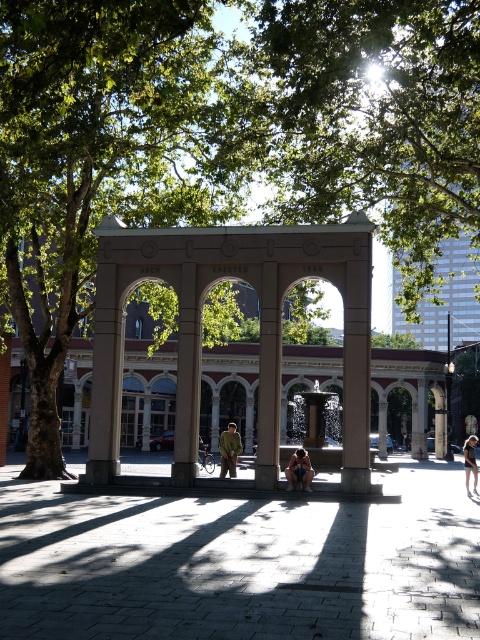
Question: Can you confirm if concrete bench at center is positioned above matte pink stone archway at center?

Choices:
 (A) yes
 (B) no

Answer: (B)

Question: Is concrete bench at center behind matte pink stone archway at center?

Choices:
 (A) no
 (B) yes

Answer: (A)

Question: Among these objects, which one is farthest from the camera?

Choices:
 (A) dark hair at center
 (B) matte pink stone archway at center
 (C) matte stone column at center

Answer: (A)

Question: Where is khaki fabric jacket at center located in relation to dark hair at center in the image?

Choices:
 (A) below
 (B) above

Answer: (B)

Question: Which point is farther to the camera?

Choices:
 (A) (224, 460)
 (B) (189, 346)
 (C) (273, 474)

Answer: (A)

Question: Estimate the real-world distances between objects in this image. Which object is closer to the dark hair at center?

Choices:
 (A) matte pink stone archway at center
 (B) concrete bench at center
 (C) matte brown person at center

Answer: (C)